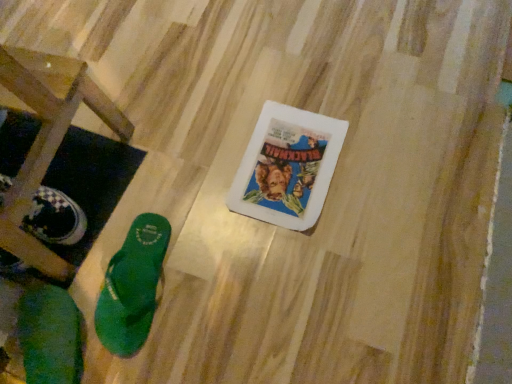
I want to click on green rubber flip-flop at lower left, acting as the 2th footwear starting from the left, so click(x=132, y=286).

What do you see at coordinates (50, 336) in the screenshot?
I see `green fabric flip-flop at lower left, positioned as the first footwear in left-to-right order` at bounding box center [50, 336].

Where is `wooden stool at lower left`? wooden stool at lower left is located at coordinates (47, 139).

Can you see green fabric flip-flop at lower left, positioned as the first footwear in left-to-right order, touching green rubber flip-flop at lower left, which is counted as the first footwear, starting from the right?

No, green fabric flip-flop at lower left, positioned as the first footwear in left-to-right order, is not with green rubber flip-flop at lower left, which is counted as the first footwear, starting from the right.

Considering the sizes of objects green fabric flip-flop at lower left, positioned as the first footwear in left-to-right order, and green rubber flip-flop at lower left, acting as the 2th footwear starting from the left, in the image provided, who is taller, green fabric flip-flop at lower left, positioned as the first footwear in left-to-right order, or green rubber flip-flop at lower left, acting as the 2th footwear starting from the left,?

green fabric flip-flop at lower left, positioned as the first footwear in left-to-right order.

Can we say green fabric flip-flop at lower left, the second footwear viewed from the right, lies outside green rubber flip-flop at lower left, which is counted as the first footwear, starting from the right?

green fabric flip-flop at lower left, the second footwear viewed from the right, lies outside green rubber flip-flop at lower left, which is counted as the first footwear, starting from the right,'s area.

From the image's perspective, between green fabric flip-flop at lower left, positioned as the first footwear in left-to-right order, and wooden stool at lower left, who is located below?

green fabric flip-flop at lower left, positioned as the first footwear in left-to-right order.

From a real-world perspective, who is located higher, green fabric flip-flop at lower left, the second footwear viewed from the right, or wooden stool at lower left?

wooden stool at lower left.

Is green fabric flip-flop at lower left, positioned as the first footwear in left-to-right order, taller or shorter than wooden stool at lower left?

In the image, green fabric flip-flop at lower left, positioned as the first footwear in left-to-right order, appears to be shorter than wooden stool at lower left.

Based on the photo, can you confirm if green fabric flip-flop at lower left, the second footwear viewed from the right, is smaller than wooden stool at lower left?

Indeed, green fabric flip-flop at lower left, the second footwear viewed from the right, has a smaller size compared to wooden stool at lower left.

From a real-world perspective, is green rubber flip-flop at lower left, which is counted as the first footwear, starting from the right, physically located above or below wooden stool at lower left?

green rubber flip-flop at lower left, which is counted as the first footwear, starting from the right, is below wooden stool at lower left.

Can you tell me how much green rubber flip-flop at lower left, which is counted as the first footwear, starting from the right, and wooden stool at lower left differ in facing direction?

The facing directions of green rubber flip-flop at lower left, which is counted as the first footwear, starting from the right, and wooden stool at lower left are 3.7 degrees apart.

From the image's perspective, is green rubber flip-flop at lower left, acting as the 2th footwear starting from the left, above wooden stool at lower left?

No, from the image's perspective, green rubber flip-flop at lower left, acting as the 2th footwear starting from the left, is not on top of wooden stool at lower left.

Is green rubber flip-flop at lower left, which is counted as the first footwear, starting from the right, wider or thinner than wooden stool at lower left?

In the image, green rubber flip-flop at lower left, which is counted as the first footwear, starting from the right, appears to be more narrow than wooden stool at lower left.

Starting from the wooden stool at lower left, which footwear is the 1st one to the right? Please provide its 2D coordinates.

[(50, 336)]

Is the surface of wooden stool at lower left in direct contact with green fabric flip-flop at lower left, positioned as the first footwear in left-to-right order?

No, wooden stool at lower left is not next to green fabric flip-flop at lower left, positioned as the first footwear in left-to-right order.

Does wooden stool at lower left appear on the right side of green fabric flip-flop at lower left, the second footwear viewed from the right?

No.

Is green rubber flip-flop at lower left, acting as the 2th footwear starting from the left, at the back of wooden stool at lower left?

No.

Is wooden stool at lower left positioned far away from green rubber flip-flop at lower left, acting as the 2th footwear starting from the left?

That's not correct — wooden stool at lower left is a little close to green rubber flip-flop at lower left, acting as the 2th footwear starting from the left.

This screenshot has height=384, width=512. In order to click on furniture that is on the left side of green rubber flip-flop at lower left, acting as the 2th footwear starting from the left in this screenshot , I will do `click(47, 139)`.

Does wooden stool at lower left have a larger size compared to green rubber flip-flop at lower left, acting as the 2th footwear starting from the left?

Indeed, wooden stool at lower left has a larger size compared to green rubber flip-flop at lower left, acting as the 2th footwear starting from the left.

Does point (115, 275) come behind point (42, 293)?

That is True.

Does green rubber flip-flop at lower left, which is counted as the first footwear, starting from the right, have a larger size compared to green fabric flip-flop at lower left, the second footwear viewed from the right?

No.

Considering the sizes of green rubber flip-flop at lower left, which is counted as the first footwear, starting from the right, and green fabric flip-flop at lower left, the second footwear viewed from the right, in the image, is green rubber flip-flop at lower left, which is counted as the first footwear, starting from the right, wider or thinner than green fabric flip-flop at lower left, the second footwear viewed from the right,?

Considering their sizes, green rubber flip-flop at lower left, which is counted as the first footwear, starting from the right, looks slimmer than green fabric flip-flop at lower left, the second footwear viewed from the right.

Locate an element on the screen. footwear located on the left of green rubber flip-flop at lower left, acting as the 2th footwear starting from the left is located at coordinates (x=50, y=336).

The width and height of the screenshot is (512, 384). I want to click on furniture above the green fabric flip-flop at lower left, the second footwear viewed from the right (from a real-world perspective), so click(x=47, y=139).

Looking at the image, which one is located further to green fabric flip-flop at lower left, positioned as the first footwear in left-to-right order, wooden stool at lower left or green rubber flip-flop at lower left, which is counted as the first footwear, starting from the right?

Among the two, wooden stool at lower left is located further to green fabric flip-flop at lower left, positioned as the first footwear in left-to-right order.

When comparing their distances from green rubber flip-flop at lower left, acting as the 2th footwear starting from the left, does green fabric flip-flop at lower left, the second footwear viewed from the right, or wooden stool at lower left seem further?

Among the two, wooden stool at lower left is located further to green rubber flip-flop at lower left, acting as the 2th footwear starting from the left.

Looking at the image, which one is located closer to wooden stool at lower left, green rubber flip-flop at lower left, acting as the 2th footwear starting from the left, or green fabric flip-flop at lower left, positioned as the first footwear in left-to-right order?

Among the two, green rubber flip-flop at lower left, acting as the 2th footwear starting from the left, is located nearer to wooden stool at lower left.

Looking at this image, based on their spatial positions, is green fabric flip-flop at lower left, positioned as the first footwear in left-to-right order, or green rubber flip-flop at lower left, which is counted as the first footwear, starting from the right, closer to wooden stool at lower left?

The object closer to wooden stool at lower left is green rubber flip-flop at lower left, which is counted as the first footwear, starting from the right.

Estimate the real-world distances between objects in this image. Which object is closer to green fabric flip-flop at lower left, the second footwear viewed from the right, green rubber flip-flop at lower left, which is counted as the first footwear, starting from the right, or wooden stool at lower left?

green rubber flip-flop at lower left, which is counted as the first footwear, starting from the right, is closer to green fabric flip-flop at lower left, the second footwear viewed from the right.

When comparing their distances from green rubber flip-flop at lower left, acting as the 2th footwear starting from the left, does wooden stool at lower left or green fabric flip-flop at lower left, positioned as the first footwear in left-to-right order, seem further?

wooden stool at lower left lies further to green rubber flip-flop at lower left, acting as the 2th footwear starting from the left, than the other object.

At what (x,y) coordinates should I click in order to perform the action: click on footwear between wooden stool at lower left and green fabric flip-flop at lower left, positioned as the first footwear in left-to-right order, vertically. Please return your answer as a coordinate pair (x, y). Looking at the image, I should click on click(x=132, y=286).